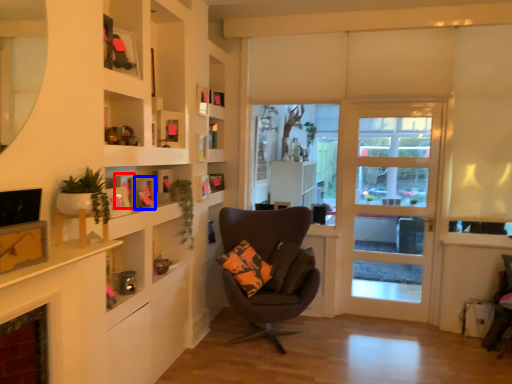
Question: Which object appears farthest to the camera in this image, picture frame (highlighted by a red box) or picture frame (highlighted by a blue box)?

Choices:
 (A) picture frame
 (B) picture frame

Answer: (B)